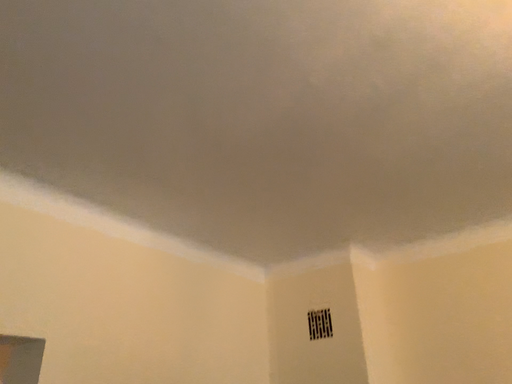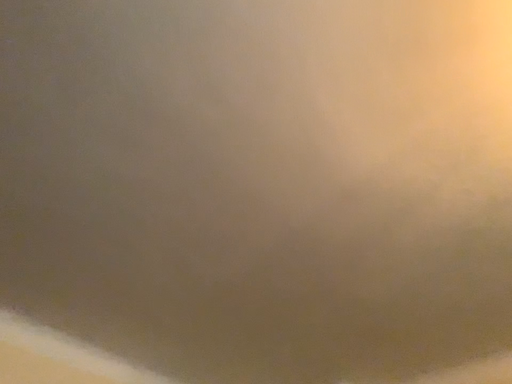
Question: How did the camera likely rotate when shooting the video?

Choices:
 (A) rotated downward
 (B) rotated upward

Answer: (B)